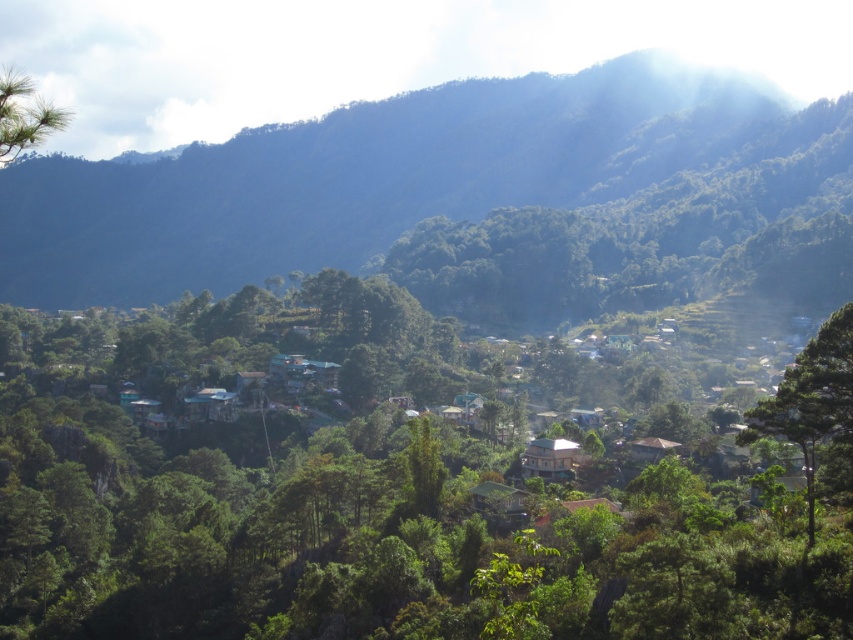
Question: Is green leafy tree at center smaller than green leafy tree at right?

Choices:
 (A) no
 (B) yes

Answer: (A)

Question: Which object appears closest to the camera in this image?

Choices:
 (A) green leafy tree at center
 (B) green forested mountain at upper center
 (C) green leafy tree at right
 (D) green matte tree at upper left

Answer: (D)

Question: Which of the following is the closest to the observer?

Choices:
 (A) green forested mountain at upper center
 (B) green leafy tree at center
 (C) green matte tree at upper left
 (D) green leafy tree at right

Answer: (C)

Question: Which point is farther from the camera taking this photo?

Choices:
 (A) (740, 572)
 (B) (0, 102)
 (C) (134, 301)

Answer: (C)

Question: Is green forested mountain at upper center bigger than green leafy tree at right?

Choices:
 (A) yes
 (B) no

Answer: (A)

Question: Does green forested mountain at upper center have a lesser width compared to green matte tree at upper left?

Choices:
 (A) no
 (B) yes

Answer: (A)